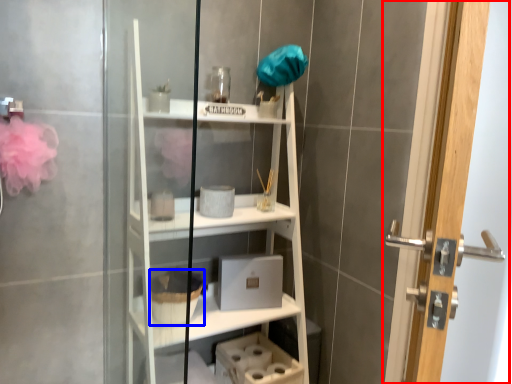
Question: Which object is further to the camera taking this photo, door (highlighted by a red box) or basket (highlighted by a blue box)?

Choices:
 (A) door
 (B) basket

Answer: (B)